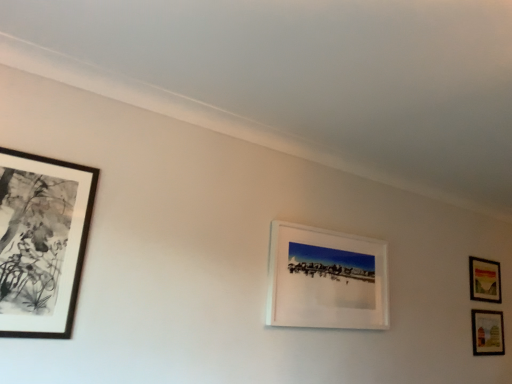
Question: Is matte wooden picture frame at lower right, positioned as the 3th picture frame in front-to-back order, positioned before white matte picture frame at center, which is counted as the second picture frame, starting from the front?

Choices:
 (A) yes
 (B) no

Answer: (B)

Question: Is matte wooden picture frame at lower right, marked as the third picture frame in a left-to-right arrangement, turned away from white matte picture frame at center, the 3th picture frame in the right-to-left sequence?

Choices:
 (A) yes
 (B) no

Answer: (B)

Question: Is matte wooden picture frame at lower right, marked as the third picture frame in a left-to-right arrangement, shorter than white matte picture frame at center, which is the 2th picture frame from left to right?

Choices:
 (A) no
 (B) yes

Answer: (B)

Question: Is matte wooden picture frame at lower right, positioned as the 3th picture frame in front-to-back order, oriented towards white matte picture frame at center, which is the third picture frame in back-to-front order?

Choices:
 (A) no
 (B) yes

Answer: (A)

Question: Would you say matte wooden picture frame at lower right, positioned as the 3th picture frame in front-to-back order, contains white matte picture frame at center, which is the third picture frame in back-to-front order?

Choices:
 (A) no
 (B) yes

Answer: (A)

Question: Is matte wooden picture frame at lower right, the second picture frame in the back-to-front sequence, directly adjacent to white matte picture frame at center, the 3th picture frame in the right-to-left sequence?

Choices:
 (A) no
 (B) yes

Answer: (A)

Question: Considering the relative positions of black matte picture frame at left, which is the fourth picture frame in right-to-left order, and matte wooden picture frame at lower right, which is counted as the 1th picture frame, starting from the right, in the image provided, is black matte picture frame at left, which is the fourth picture frame in right-to-left order, to the right of matte wooden picture frame at lower right, which is counted as the 1th picture frame, starting from the right, from the viewer's perspective?

Choices:
 (A) no
 (B) yes

Answer: (A)

Question: Is black matte picture frame at left, which ranks as the fourth picture frame in back-to-front order, surrounding matte wooden picture frame at lower right, arranged as the first picture frame when viewed from the back?

Choices:
 (A) no
 (B) yes

Answer: (A)

Question: Could you tell me if black matte picture frame at left, placed as the first picture frame when sorted from front to back, is turned towards matte wooden picture frame at lower right, which is counted as the 1th picture frame, starting from the right?

Choices:
 (A) no
 (B) yes

Answer: (A)

Question: Does black matte picture frame at left, the first picture frame viewed from the left, have a larger size compared to matte wooden picture frame at lower right, which is the 4th picture frame from left to right?

Choices:
 (A) no
 (B) yes

Answer: (B)

Question: Is the position of black matte picture frame at left, the first picture frame viewed from the left, more distant than that of matte wooden picture frame at lower right, the fourth picture frame in the front-to-back sequence?

Choices:
 (A) no
 (B) yes

Answer: (A)

Question: From a real-world perspective, is black matte picture frame at left, which is the fourth picture frame in right-to-left order, positioned under matte wooden picture frame at lower right, the fourth picture frame in the front-to-back sequence, based on gravity?

Choices:
 (A) no
 (B) yes

Answer: (B)

Question: Considering the relative positions of matte wooden picture frame at lower right, arranged as the first picture frame when viewed from the back, and black matte picture frame at left, which ranks as the fourth picture frame in back-to-front order, in the image provided, is matte wooden picture frame at lower right, arranged as the first picture frame when viewed from the back, behind black matte picture frame at left, which ranks as the fourth picture frame in back-to-front order,?

Choices:
 (A) yes
 (B) no

Answer: (A)